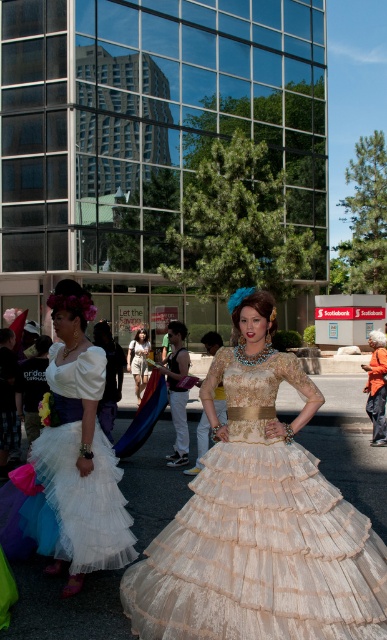
You are a photographer standing at the back of the crowd. You want to take a photo that includes both the white tulle dress at center and the orange fabric jacket at right. Given that your camera has a maximum focus range of 6 meters, will you be able to capture both subjects in focus?

The white tulle dress at center and the orange fabric jacket at right are 6.86 meters apart. Since the distance between them exceeds the camera maximum focus range of 6 meters, you won not be able to capture both subjects in focus.

You are standing at the point marked as point (260,426) in the image. You want to walk to the nearest woman. Which woman should you walk towards?

The woman on the left is closer to point (260,426) than the woman on the right, so you should walk towards the woman on the left.